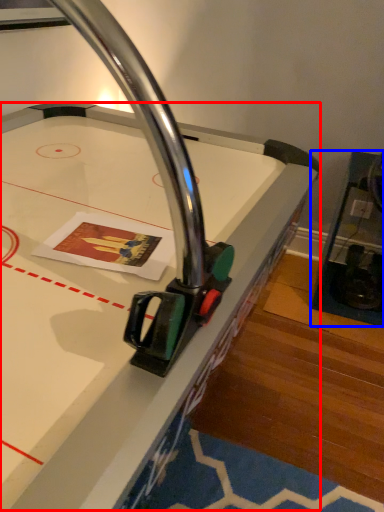
Question: Which object appears closest to the camera in this image, table (highlighted by a red box) or furniture (highlighted by a blue box)?

Choices:
 (A) table
 (B) furniture

Answer: (A)